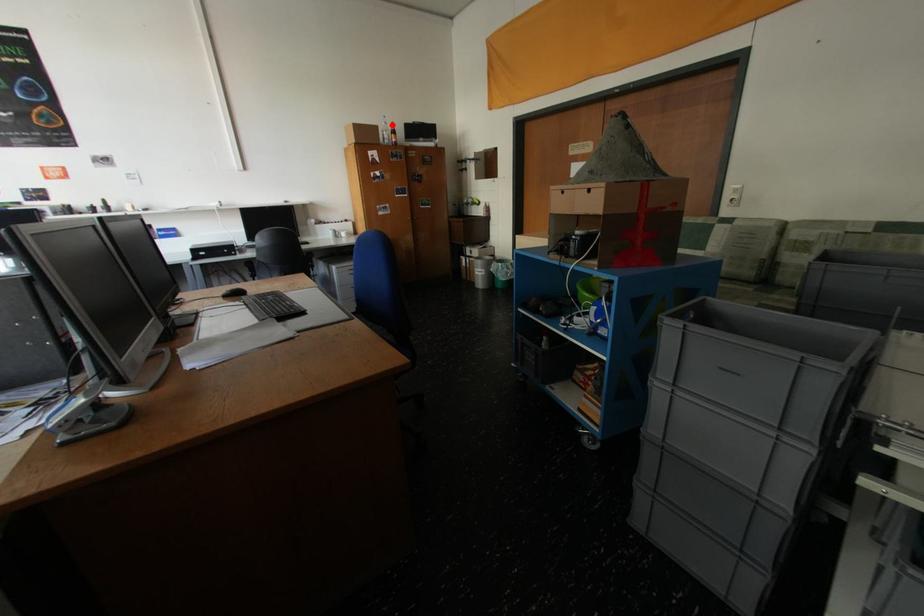
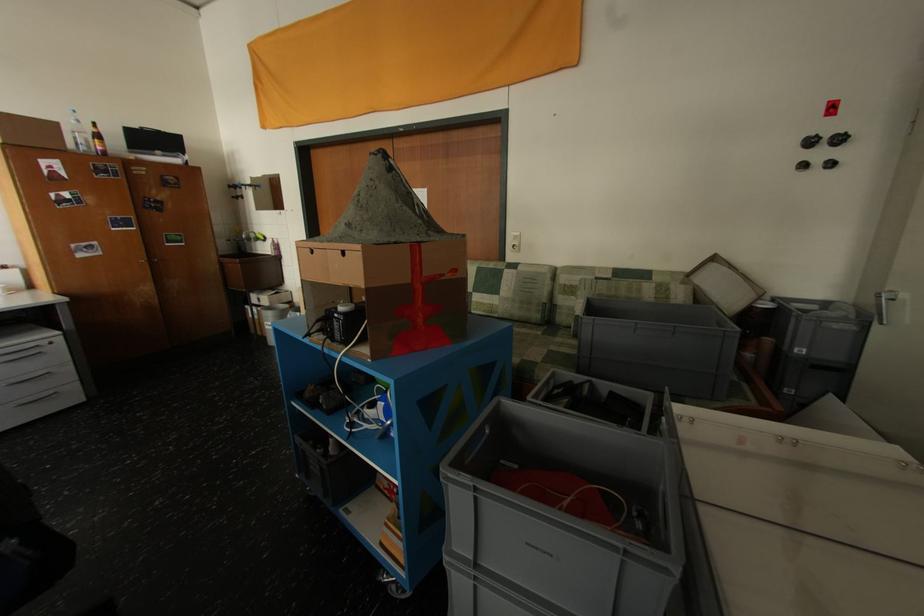
Locate, in the second image, the point that corresponds to the highlighted location in the first image.

(81, 123)